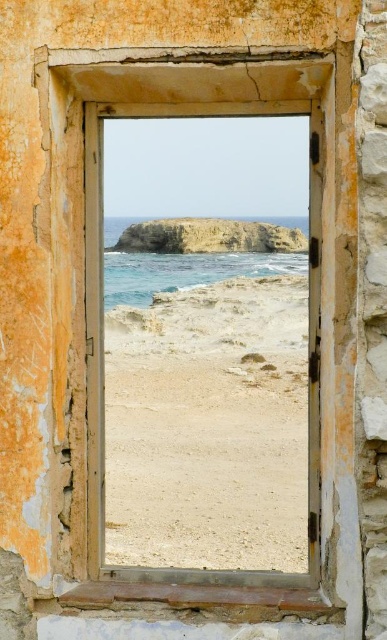
Between point (123, 307) and point (87, 317), which one is positioned in front?

Point (87, 317) is more forward.

Which is behind, point (306, 564) or point (147, 116)?

Point (306, 564)

Is point (179, 476) closer to viewer compared to point (75, 426)?

No, (179, 476) is behind (75, 426).

Image resolution: width=387 pixels, height=640 pixels. I want to click on beige sandy beach at center, so tap(208, 426).